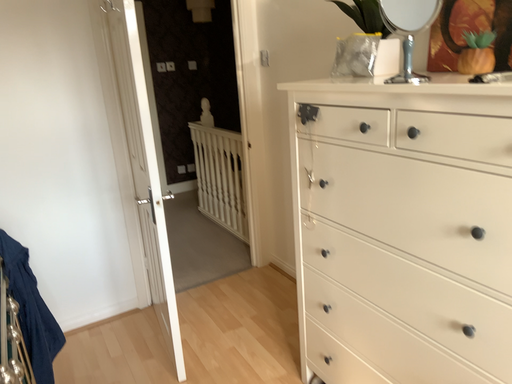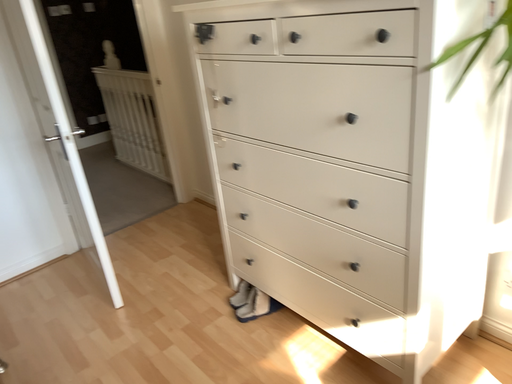
Question: How did the camera likely rotate when shooting the video?

Choices:
 (A) rotated right
 (B) rotated left

Answer: (A)